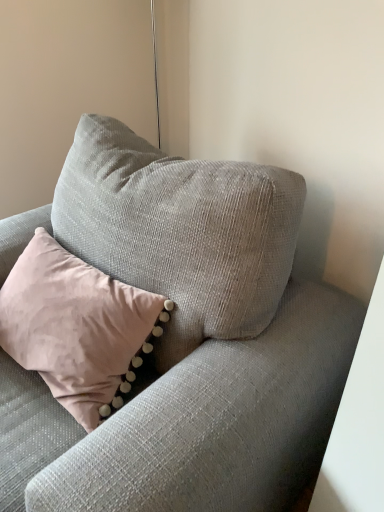
Question: Considering the relative sizes of textured gray couch at center and pink velvet pillow at upper left in the image provided, is textured gray couch at center shorter than pink velvet pillow at upper left?

Choices:
 (A) no
 (B) yes

Answer: (A)

Question: Is textured gray couch at center not within pink velvet pillow at upper left?

Choices:
 (A) no
 (B) yes

Answer: (B)

Question: Is there a large distance between textured gray couch at center and pink velvet pillow at upper left?

Choices:
 (A) yes
 (B) no

Answer: (B)

Question: Does textured gray couch at center have a smaller size compared to pink velvet pillow at upper left?

Choices:
 (A) no
 (B) yes

Answer: (A)

Question: Is textured gray couch at center at the left side of pink velvet pillow at upper left?

Choices:
 (A) no
 (B) yes

Answer: (A)

Question: Can you see textured gray couch at center touching pink velvet pillow at upper left?

Choices:
 (A) no
 (B) yes

Answer: (A)

Question: Is pink velvet pillow at upper left facing away from textured gray couch at center?

Choices:
 (A) yes
 (B) no

Answer: (A)

Question: Is pink velvet pillow at upper left positioned in front of textured gray couch at center?

Choices:
 (A) yes
 (B) no

Answer: (B)

Question: Are pink velvet pillow at upper left and textured gray couch at center beside each other?

Choices:
 (A) yes
 (B) no

Answer: (B)

Question: Is pink velvet pillow at upper left not near textured gray couch at center?

Choices:
 (A) no
 (B) yes

Answer: (A)

Question: Is pink velvet pillow at upper left to the left of textured gray couch at center from the viewer's perspective?

Choices:
 (A) no
 (B) yes

Answer: (B)

Question: From the image's perspective, is pink velvet pillow at upper left below textured gray couch at center?

Choices:
 (A) yes
 (B) no

Answer: (B)

Question: Is textured gray couch at center inside the boundaries of pink velvet pillow at upper left, or outside?

Choices:
 (A) inside
 (B) outside

Answer: (B)